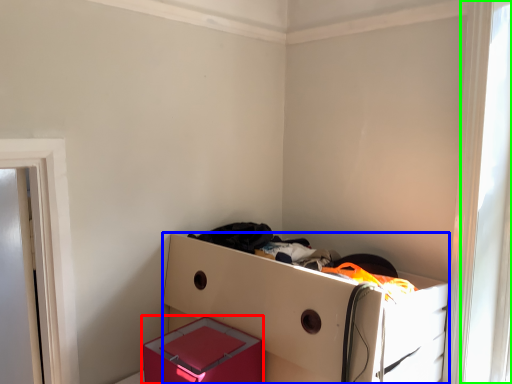
Question: Considering the real-world distances, which object is farthest from box (highlighted by a red box)? furniture (highlighted by a blue box) or window (highlighted by a green box)?

Choices:
 (A) furniture
 (B) window

Answer: (B)